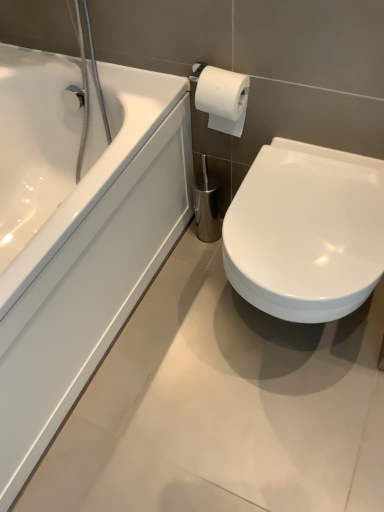
Measure the distance between point (43, 446) and camera.

The distance of point (43, 446) from camera is 1.12 meters.

Identify the location of white glossy bathtub at left. Image resolution: width=384 pixels, height=512 pixels. (77, 232).

This screenshot has height=512, width=384. What do you see at coordinates (77, 232) in the screenshot? I see `white glossy bathtub at left` at bounding box center [77, 232].

In order to face white glossy bathtub at left, should I rotate leftwards or rightwards?

Turn left approximately 23.927 degrees to face it.

What is the approximate height of white glossy toilet at lower right?

It is 47.71 centimeters.

The width and height of the screenshot is (384, 512). What do you see at coordinates (306, 232) in the screenshot?
I see `white glossy toilet at lower right` at bounding box center [306, 232].

This screenshot has height=512, width=384. In order to click on white glossy toilet at lower right in this screenshot , I will do `click(306, 232)`.

At what (x,y) coordinates should I click in order to perform the action: click on white glossy bathtub at left. Please return your answer as a coordinate pair (x, y). The height and width of the screenshot is (512, 384). Looking at the image, I should click on (77, 232).

Looking at this image, considering the relative positions of white glossy toilet at lower right and white glossy bathtub at left in the image provided, is white glossy toilet at lower right to the left of white glossy bathtub at left from the viewer's perspective?

In fact, white glossy toilet at lower right is to the right of white glossy bathtub at left.

Is white glossy toilet at lower right in front of or behind white glossy bathtub at left in the image?

white glossy toilet at lower right is positioned farther from the viewer than white glossy bathtub at left.

Which is closer, (311, 309) or (13, 214)?

The point (311, 309) is in front.

From the image's perspective, is white glossy toilet at lower right on top of white glossy bathtub at left?

Actually, white glossy toilet at lower right appears below white glossy bathtub at left in the image.

From a real-world perspective, is white glossy toilet at lower right physically located above or below white glossy bathtub at left?

white glossy toilet at lower right is situated lower than white glossy bathtub at left in the real world.

Considering the sizes of objects white glossy toilet at lower right and white glossy bathtub at left in the image provided, who is thinner, white glossy toilet at lower right or white glossy bathtub at left?

white glossy toilet at lower right is thinner.

In the scene shown: Does white glossy toilet at lower right have a greater height compared to white glossy bathtub at left?

In fact, white glossy toilet at lower right may be shorter than white glossy bathtub at left.

Is white glossy toilet at lower right smaller than white glossy bathtub at left?

Yes, white glossy toilet at lower right is smaller than white glossy bathtub at left.

Do you think white glossy toilet at lower right is within white glossy bathtub at left, or outside of it?

white glossy toilet at lower right is not inside white glossy bathtub at left, it's outside.

Based on the photo, is white glossy toilet at lower right positioned far away from white glossy bathtub at left?

No, white glossy toilet at lower right is in close proximity to white glossy bathtub at left.

Is white glossy bathtub at left at the back of white glossy toilet at lower right?

No.

Image resolution: width=384 pixels, height=512 pixels. I want to click on bathtub in front of the white glossy toilet at lower right, so click(x=77, y=232).

Is white glossy bathtub at left at the left side of white glossy toilet at lower right?

Indeed, white glossy bathtub at left is positioned on the left side of white glossy toilet at lower right.

Does white glossy bathtub at left come behind white glossy toilet at lower right?

That is False.

Which is closer, (131, 228) or (289, 180)?

The point (289, 180) is closer to the camera.

From the image's perspective, is white glossy bathtub at left located above or below white glossy toilet at lower right?

From the image's perspective, white glossy bathtub at left appears above white glossy toilet at lower right.

From a real-world perspective, does white glossy bathtub at left stand above white glossy toilet at lower right?

Yes, from a real-world perspective, white glossy bathtub at left is over white glossy toilet at lower right

From the picture: Considering the relative sizes of white glossy bathtub at left and white glossy toilet at lower right in the image provided, is white glossy bathtub at left thinner than white glossy toilet at lower right?

In fact, white glossy bathtub at left might be wider than white glossy toilet at lower right.

Does white glossy bathtub at left have a lesser height compared to white glossy toilet at lower right?

No.

Considering the sizes of objects white glossy bathtub at left and white glossy toilet at lower right in the image provided, who is bigger, white glossy bathtub at left or white glossy toilet at lower right?

white glossy bathtub at left.

Would you say white glossy bathtub at left is inside or outside white glossy toilet at lower right?

white glossy bathtub at left is located beyond the bounds of white glossy toilet at lower right.

Consider the image. Is white glossy bathtub at left next to white glossy toilet at lower right?

white glossy bathtub at left and white glossy toilet at lower right are not in contact.

Is white glossy bathtub at left oriented away from white glossy toilet at lower right?

white glossy bathtub at left does not have its back to white glossy toilet at lower right.

Locate an element on the screen. toilet that is behind the white glossy bathtub at left is located at coordinates (306, 232).

This screenshot has width=384, height=512. I want to click on toilet below the white glossy bathtub at left (from a real-world perspective), so click(306, 232).

Where is `bathtub to the left of white glossy toilet at lower right`? This screenshot has height=512, width=384. bathtub to the left of white glossy toilet at lower right is located at coordinates (77, 232).